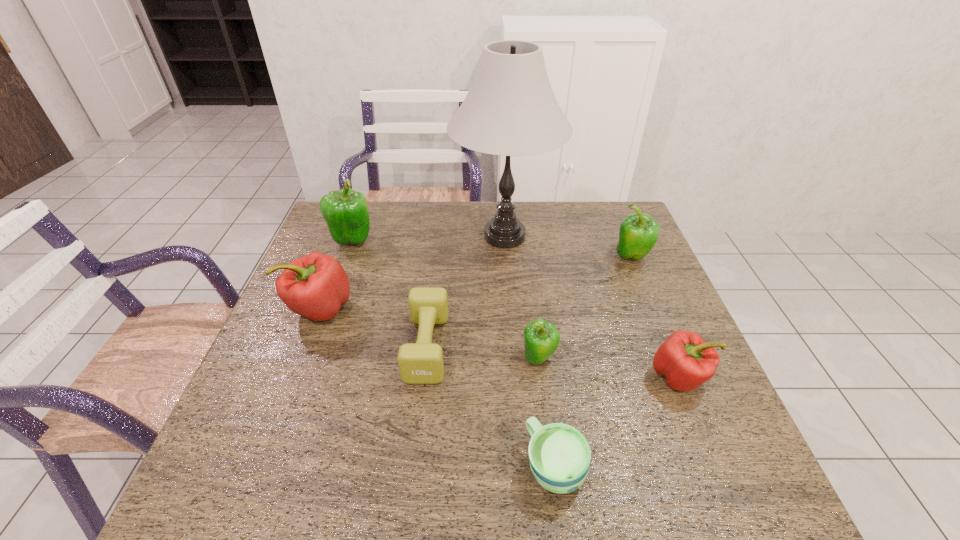
Where is `vacant region between the rightmost green bell pepper and the nearer pink bell pepper`? The height and width of the screenshot is (540, 960). vacant region between the rightmost green bell pepper and the nearer pink bell pepper is located at coordinates (656, 316).

Identify which object is located as the seventh nearest to the bigger pink bell pepper. Please provide its 2D coordinates. Your answer should be formatted as a tuple, i.e. [(x, y)], where the tuple contains the x and y coordinates of a point satisfying the conditions above.

[(638, 233)]

At what (x,y) coordinates should I click in order to perform the action: click on object that is the fifth closest one to the second tallest object. Please return your answer as a coordinate pair (x, y). Looking at the image, I should click on (559, 455).

Locate an element on the screen. The width and height of the screenshot is (960, 540). the fourth closest bell pepper to the black lamp is located at coordinates (541, 339).

Point out which bell pepper is positioned as the second nearest to the nearer pink bell pepper. Please provide its 2D coordinates. Your answer should be formatted as a tuple, i.e. [(x, y)], where the tuple contains the x and y coordinates of a point satisfying the conditions above.

[(638, 233)]

Locate an element on the screen. The image size is (960, 540). green bell pepper that is the second nearest to the cup is located at coordinates (638, 233).

Where is `green bell pepper that is the closest to the third bell pepper from left to right`? The image size is (960, 540). green bell pepper that is the closest to the third bell pepper from left to right is located at coordinates (638, 233).

Image resolution: width=960 pixels, height=540 pixels. Find the location of `blank area in the image that satisfies the following two spatial constraints: 1. on the back side of the rightmost green bell pepper; 2. on the left side of the dumbbell`. blank area in the image that satisfies the following two spatial constraints: 1. on the back side of the rightmost green bell pepper; 2. on the left side of the dumbbell is located at coordinates (438, 256).